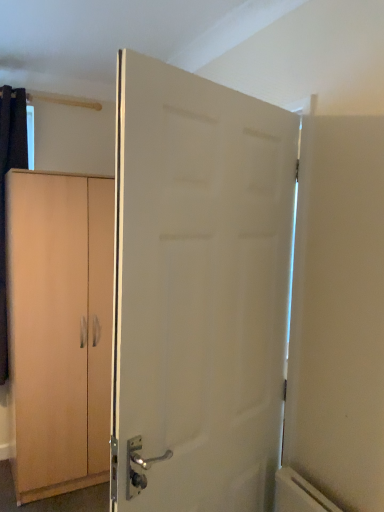
This screenshot has width=384, height=512. Describe the element at coordinates (59, 330) in the screenshot. I see `light wood cabinet at left` at that location.

What is the approximate width of light wood cabinet at left?

The width of light wood cabinet at left is 22.03 inches.

Measure the distance between point (41,199) and camera.

The depth of point (41,199) is 2.22 meters.

You are a GUI agent. You are given a task and a screenshot of the screen. Output one action in this format:
    pyautogui.click(x=<x>, y=<y>)
    Task: Click on the light wood cabinet at left
    The width and height of the screenshot is (384, 512).
    Given the screenshot: What is the action you would take?
    pyautogui.click(x=59, y=330)

You are a GUI agent. You are given a task and a screenshot of the screen. Output one action in this format:
    pyautogui.click(x=<x>, y=<y>)
    Task: Click on the white matte door at center
    
    Given the screenshot: What is the action you would take?
    pyautogui.click(x=198, y=291)

What do you see at coordinates (198, 291) in the screenshot? I see `white matte door at center` at bounding box center [198, 291].

Where is `light wood cabinet at left`? light wood cabinet at left is located at coordinates (59, 330).

Visually, is light wood cabinet at left positioned to the left or to the right of white matte door at center?

light wood cabinet at left is to the left of white matte door at center.

Which object is more forward, light wood cabinet at left or white matte door at center?

Positioned in front is white matte door at center.

Does point (23, 313) lie behind point (223, 130)?

That is True.

From the image's perspective, is light wood cabinet at left on top of white matte door at center?

No, from the image's perspective, light wood cabinet at left is not over white matte door at center.

Looking at this image, from a real-world perspective, is light wood cabinet at left located beneath white matte door at center?

Correct, in the physical world, light wood cabinet at left is lower than white matte door at center.

Considering the sizes of objects light wood cabinet at left and white matte door at center in the image provided, who is thinner, light wood cabinet at left or white matte door at center?

white matte door at center.

From their relative heights in the image, would you say light wood cabinet at left is taller or shorter than white matte door at center?

Clearly, light wood cabinet at left is taller compared to white matte door at center.

Is light wood cabinet at left bigger than white matte door at center?

Indeed, light wood cabinet at left has a larger size compared to white matte door at center.

Is light wood cabinet at left situated inside white matte door at center or outside?

light wood cabinet at left cannot be found inside white matte door at center.

Is light wood cabinet at left next to white matte door at center and touching it?

They are not placed beside each other.

From the picture: Could you tell me if light wood cabinet at left is turned towards white matte door at center?

Yes, light wood cabinet at left faces towards white matte door at center.

What's the angular difference between light wood cabinet at left and white matte door at center's facing directions?

161 degrees.

Image resolution: width=384 pixels, height=512 pixels. In order to click on door above the light wood cabinet at left (from the image's perspective) in this screenshot , I will do 198,291.

Which object is positioned more to the left, white matte door at center or light wood cabinet at left?

From the viewer's perspective, light wood cabinet at left appears more on the left side.

Which object is further away from the camera taking this photo, white matte door at center or light wood cabinet at left?

light wood cabinet at left is behind.

Considering the points (243, 386) and (96, 349), which point is behind, point (243, 386) or point (96, 349)?

The point (96, 349) is more distant.

From the image's perspective, relative to light wood cabinet at left, is white matte door at center above or below?

white matte door at center is situated higher than light wood cabinet at left in the image.

From a real-world perspective, which object stands above the other?

white matte door at center is physically above.

Can you confirm if white matte door at center is thinner than light wood cabinet at left?

Yes, white matte door at center is thinner than light wood cabinet at left.

Considering the sizes of objects white matte door at center and light wood cabinet at left in the image provided, who is shorter, white matte door at center or light wood cabinet at left?

white matte door at center.

Considering the relative sizes of white matte door at center and light wood cabinet at left in the image provided, is white matte door at center smaller than light wood cabinet at left?

Yes.

From the picture: Would you say white matte door at center is outside light wood cabinet at left?

white matte door at center is positioned outside light wood cabinet at left.

Is there a large distance between white matte door at center and light wood cabinet at left?

Indeed, white matte door at center is not near light wood cabinet at left.

Is white matte door at center aimed at light wood cabinet at left?

Yes.

You are a GUI agent. You are given a task and a screenshot of the screen. Output one action in this format:
    pyautogui.click(x=<x>, y=<y>)
    Task: Click on the door above the light wood cabinet at left (from the image's perspective)
    The width and height of the screenshot is (384, 512).
    Given the screenshot: What is the action you would take?
    pyautogui.click(x=198, y=291)

The image size is (384, 512). I want to click on cabinetry located behind the white matte door at center, so click(59, 330).

This screenshot has height=512, width=384. Identify the location of cabinetry that appears on the left of white matte door at center. (59, 330).